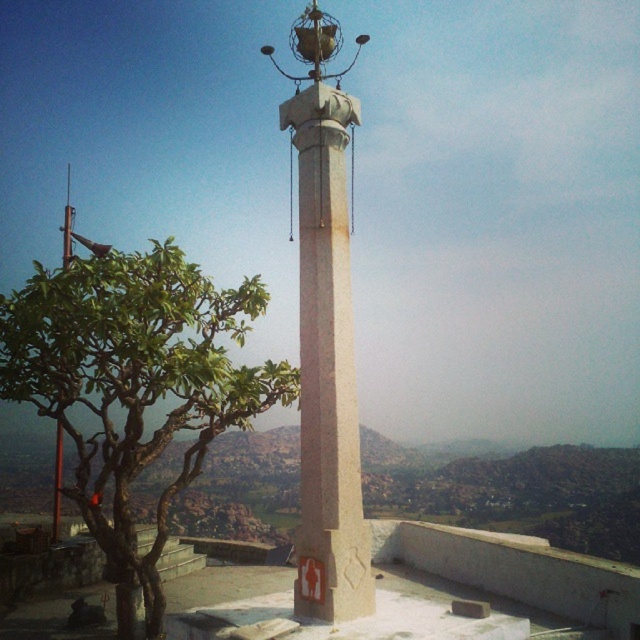
This screenshot has width=640, height=640. Describe the element at coordinates (134, 385) in the screenshot. I see `green leafy tree at left` at that location.

Is green leafy tree at left to the right of white stone column at center from the viewer's perspective?

Incorrect, green leafy tree at left is not on the right side of white stone column at center.

Image resolution: width=640 pixels, height=640 pixels. What do you see at coordinates (134, 385) in the screenshot? I see `green leafy tree at left` at bounding box center [134, 385].

You are a GUI agent. You are given a task and a screenshot of the screen. Output one action in this format:
    pyautogui.click(x=<x>, y=<y>)
    Task: Click on the green leafy tree at left
    This screenshot has height=640, width=640.
    Given the screenshot: What is the action you would take?
    pyautogui.click(x=134, y=385)